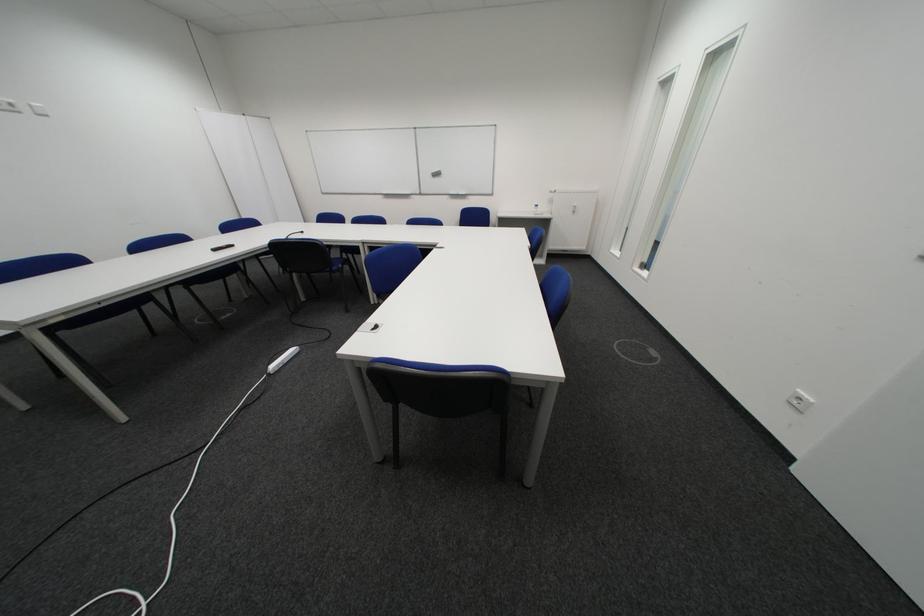
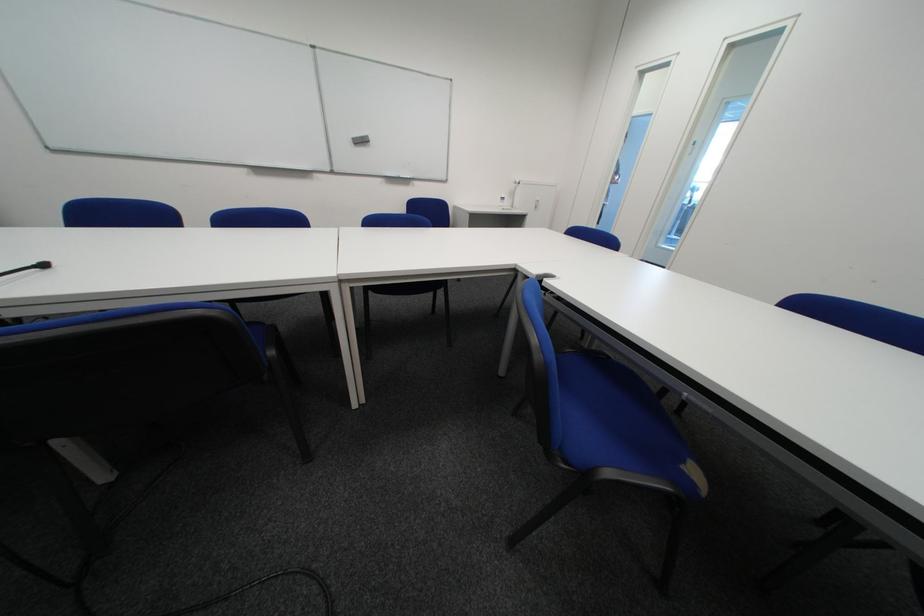
Question: I am providing you with two images of the same scene from different viewpoints. Please identify which objects are invisible in image2.

Choices:
 (A) gray whiteboard eraser
 (B) small white bottle
 (C) black microphone
 (D) none of these

Answer: (D)